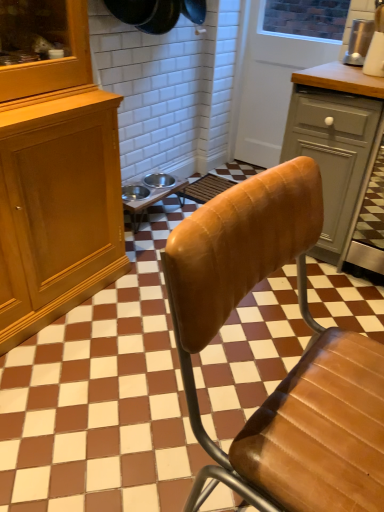
Question: Is metallic silver bowls at center at the right side of white wood screen door at upper center?

Choices:
 (A) yes
 (B) no

Answer: (B)

Question: Is metallic silver bowls at center far from white wood screen door at upper center?

Choices:
 (A) no
 (B) yes

Answer: (A)

Question: Is metallic silver bowls at center placed right next to white wood screen door at upper center?

Choices:
 (A) no
 (B) yes

Answer: (A)

Question: Considering the relative sizes of metallic silver bowls at center and white wood screen door at upper center in the image provided, is metallic silver bowls at center thinner than white wood screen door at upper center?

Choices:
 (A) yes
 (B) no

Answer: (B)

Question: Is metallic silver bowls at center further to camera compared to white wood screen door at upper center?

Choices:
 (A) yes
 (B) no

Answer: (B)

Question: Does metallic silver bowls at center have a lesser height compared to white wood screen door at upper center?

Choices:
 (A) yes
 (B) no

Answer: (A)

Question: Is metallic silver appliance at upper right further to the viewer compared to white wood screen door at upper center?

Choices:
 (A) no
 (B) yes

Answer: (A)

Question: From the image's perspective, does metallic silver appliance at upper right appear higher than white wood screen door at upper center?

Choices:
 (A) no
 (B) yes

Answer: (A)

Question: Does metallic silver appliance at upper right appear on the left side of white wood screen door at upper center?

Choices:
 (A) no
 (B) yes

Answer: (A)

Question: Considering the relative sizes of metallic silver appliance at upper right and white wood screen door at upper center in the image provided, is metallic silver appliance at upper right bigger than white wood screen door at upper center?

Choices:
 (A) no
 (B) yes

Answer: (A)

Question: Is metallic silver appliance at upper right smaller than white wood screen door at upper center?

Choices:
 (A) no
 (B) yes

Answer: (B)

Question: Can white wood screen door at upper center be found inside metallic silver appliance at upper right?

Choices:
 (A) yes
 (B) no

Answer: (B)

Question: Is metallic silver appliance at upper right oriented away from leather chair at center?

Choices:
 (A) no
 (B) yes

Answer: (A)